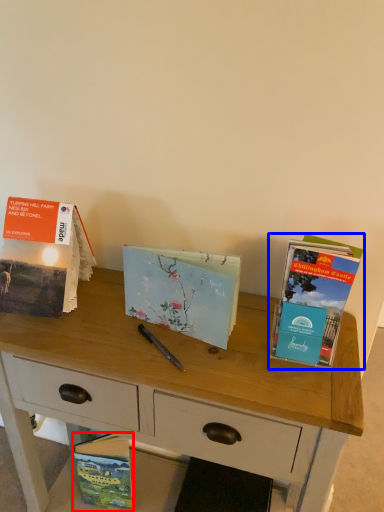
Question: Among these objects, which one is farthest to the camera, book (highlighted by a red box) or book (highlighted by a blue box)?

Choices:
 (A) book
 (B) book

Answer: (A)